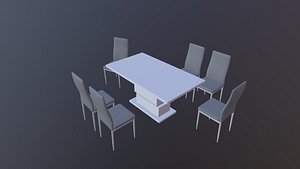
The width and height of the screenshot is (300, 169). Find the location of `table`. table is located at coordinates (167, 76).